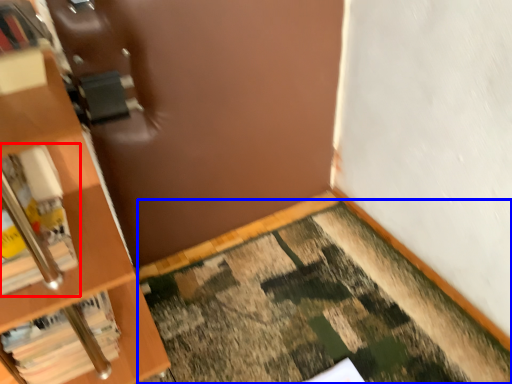
Question: Which of the following is the farthest to the observer, book (highlighted by a red box) or doormat (highlighted by a blue box)?

Choices:
 (A) book
 (B) doormat

Answer: (A)